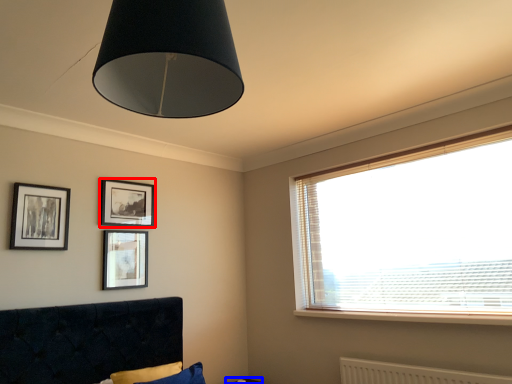
Question: Which object is further to the camera taking this photo, picture frame (highlighted by a red box) or table (highlighted by a blue box)?

Choices:
 (A) picture frame
 (B) table

Answer: (B)